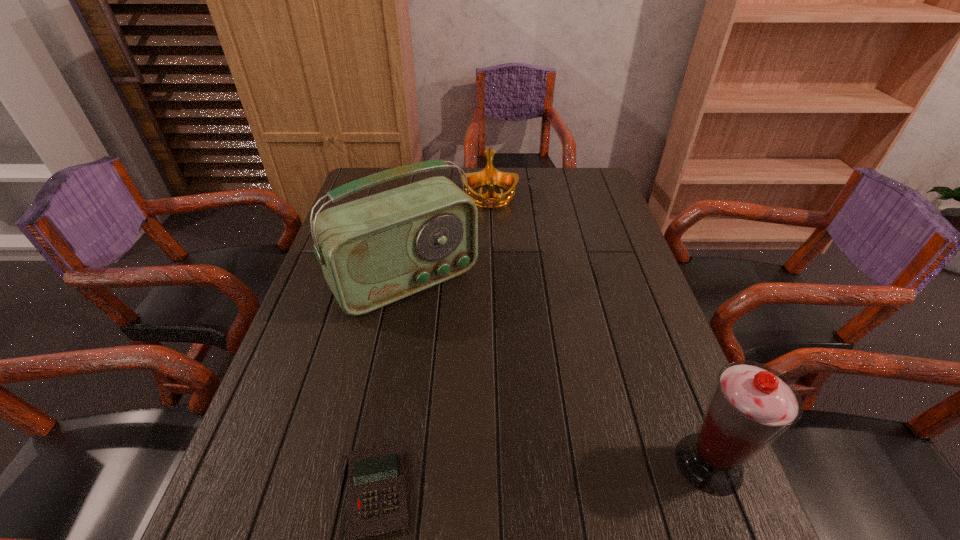
I want to click on blank space located 0.270m at the front emblem of the third tallest object, so click(493, 268).

Image resolution: width=960 pixels, height=540 pixels. Find the location of `object present at the far edge`. object present at the far edge is located at coordinates (490, 176).

Identify the location of object present at the near edge. The image size is (960, 540). (751, 405).

I want to click on object that is at the left edge, so click(374, 251).

Identify the location of object that is positioned at the right edge. (751, 405).

Identify the location of object situated at the near right corner. The width and height of the screenshot is (960, 540). (751, 405).

In order to click on blank area at the far edge in this screenshot , I will do `click(525, 187)`.

I want to click on vacant region at the near edge of the desktop, so click(x=492, y=474).

Find the location of a particular element. This screenshot has width=960, height=540. blank space at the left edge of the desktop is located at coordinates (348, 341).

Where is `vacant region at the right edge of the desktop`? The height and width of the screenshot is (540, 960). vacant region at the right edge of the desktop is located at coordinates (591, 285).